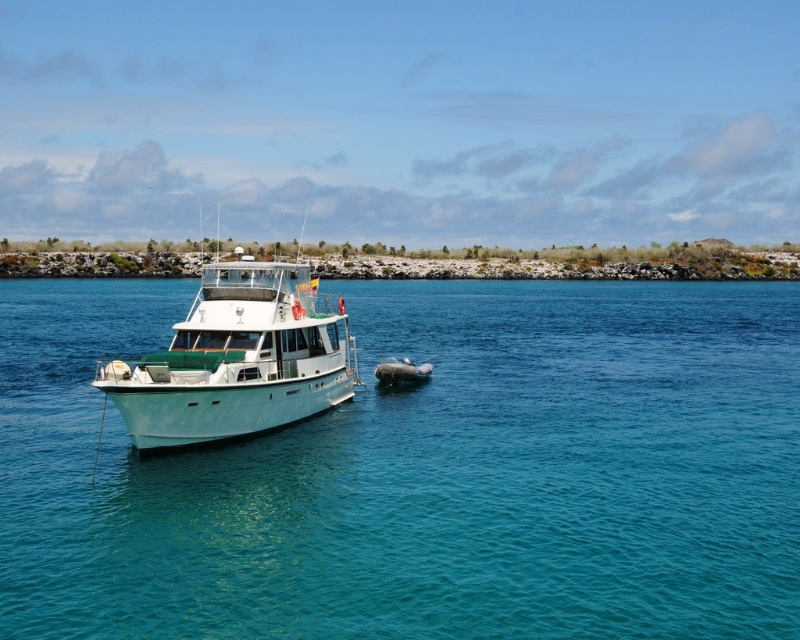
You are a photographer trying to capture the white glossy boat at left and the clear blue water at center in a single frame. Which object will appear larger in your photo?

The white glossy boat at left will appear larger in the photo than the clear blue water at center because the object description states that the clear blue water at center is smaller than the white glossy boat at left.

You are a sailor on the white glossy boat at left and you want to check the depth of the clear blue water at center. Based on the scene, can you determine if the water is deeper than the boat?

The clear blue water at center is not as tall as the white glossy boat at left, which means the water depth at that point is less than the boat height. Therefore, the boat might not be able to navigate safely there due to shallow waters.

You are a sailor on the white glossy boat at left and you want to jump into the clear blue water at center. Is the water within your immediate reach from the boat?

The clear blue water at center is closer to the viewer than the white glossy boat at left, so yes, the water is within immediate reach of the boat.